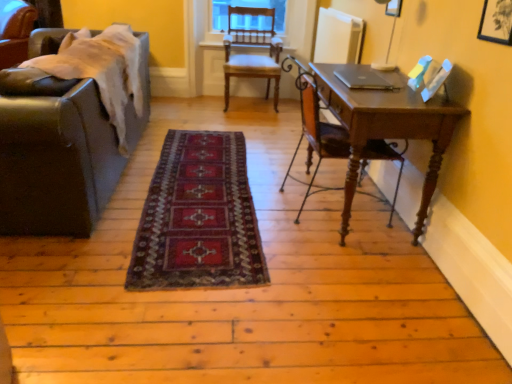
Question: Is wooden desk at right in front of wooden chair at right, marked as the 1th chair in a right-to-left arrangement?

Choices:
 (A) no
 (B) yes

Answer: (B)

Question: Is wooden desk at right at the right side of wooden chair at right, marked as the third chair in a back-to-front arrangement?

Choices:
 (A) yes
 (B) no

Answer: (A)

Question: Does wooden desk at right have a lesser height compared to wooden chair at right, marked as the 1th chair in a right-to-left arrangement?

Choices:
 (A) yes
 (B) no

Answer: (A)

Question: Considering the relative sizes of wooden desk at right and wooden chair at right, marked as the third chair in a back-to-front arrangement, in the image provided, is wooden desk at right bigger than wooden chair at right, marked as the third chair in a back-to-front arrangement,?

Choices:
 (A) no
 (B) yes

Answer: (B)

Question: Is wooden desk at right touching wooden chair at right, the first chair in the front-to-back sequence?

Choices:
 (A) yes
 (B) no

Answer: (B)

Question: Does point (30, 16) appear closer or farther from the camera than point (273, 21)?

Choices:
 (A) closer
 (B) farther

Answer: (A)

Question: Considering the positions of leather couch at left, marked as the first chair in a left-to-right arrangement, and wooden chair at center, the second chair viewed from the back, in the image, is leather couch at left, marked as the first chair in a left-to-right arrangement, wider or thinner than wooden chair at center, the second chair viewed from the back,?

Choices:
 (A) thin
 (B) wide

Answer: (A)

Question: From a real-world perspective, is leather couch at left, which appears as the first chair when viewed from the back, physically located above or below wooden chair at center, the 2th chair when ordered from left to right?

Choices:
 (A) above
 (B) below

Answer: (A)

Question: From the image's perspective, is leather couch at left, which appears as the first chair when viewed from the back, above or below wooden chair at center, the 2th chair when ordered from left to right?

Choices:
 (A) above
 (B) below

Answer: (A)

Question: Considering the positions of point (367, 71) and point (389, 120), is point (367, 71) closer or farther from the camera than point (389, 120)?

Choices:
 (A) farther
 (B) closer

Answer: (A)

Question: From a real-world perspective, relative to wooden desk at right, is sleek silver laptop at center vertically above or below?

Choices:
 (A) above
 (B) below

Answer: (A)

Question: From the image's perspective, is sleek silver laptop at center positioned above or below wooden desk at right?

Choices:
 (A) below
 (B) above

Answer: (B)

Question: Looking at the image, does sleek silver laptop at center seem bigger or smaller compared to wooden desk at right?

Choices:
 (A) small
 (B) big

Answer: (A)

Question: From the image's perspective, is wooden desk at right above or below leather couch at left?

Choices:
 (A) below
 (B) above

Answer: (A)

Question: Visually, is wooden desk at right positioned to the left or to the right of leather couch at left?

Choices:
 (A) left
 (B) right

Answer: (B)